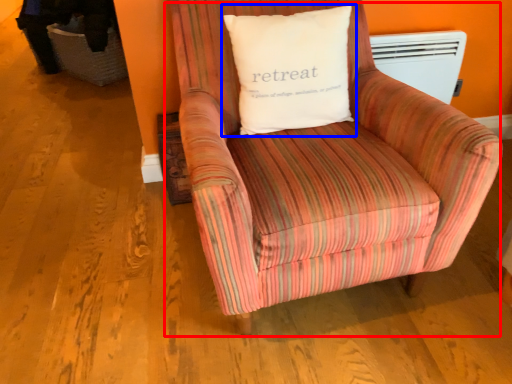
Question: Among these objects, which one is farthest to the camera, chair (highlighted by a red box) or pillow (highlighted by a blue box)?

Choices:
 (A) chair
 (B) pillow

Answer: (B)